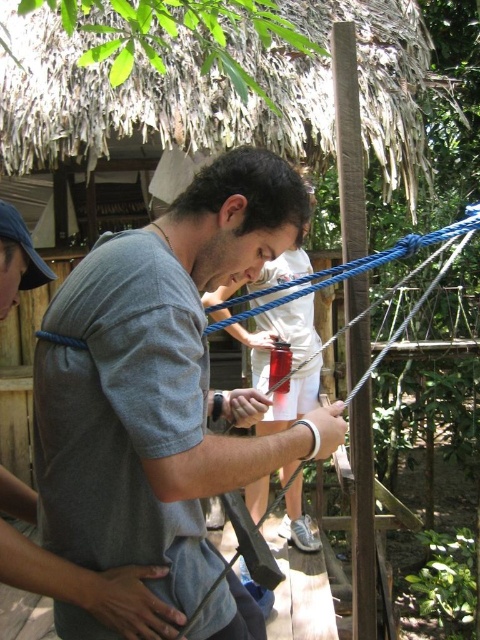
You are standing at the center of the ropes course and see two points marked on the ground. The first point is at coordinates point [182,208] and the second point is at coordinates point [300,387]. Which point is closer to you?

Point [182,208] is closer to the viewer than point [300,387].

You are a safety inspector checking the ropes course setup. You notice two people wearing gray matte shirts at center. The safety guidelines require a minimum distance of 1.5 meters between participants to ensure safety. Based on the scene description, is the current distance between the gray matte shirt at center and the matte gray shirt at center compliant with the safety guidelines?

The distance between the gray matte shirt at center and the matte gray shirt at center is 1.26 meters, which is less than the required 1.5 meters. Therefore, the current setup does not comply with the safety guidelines.